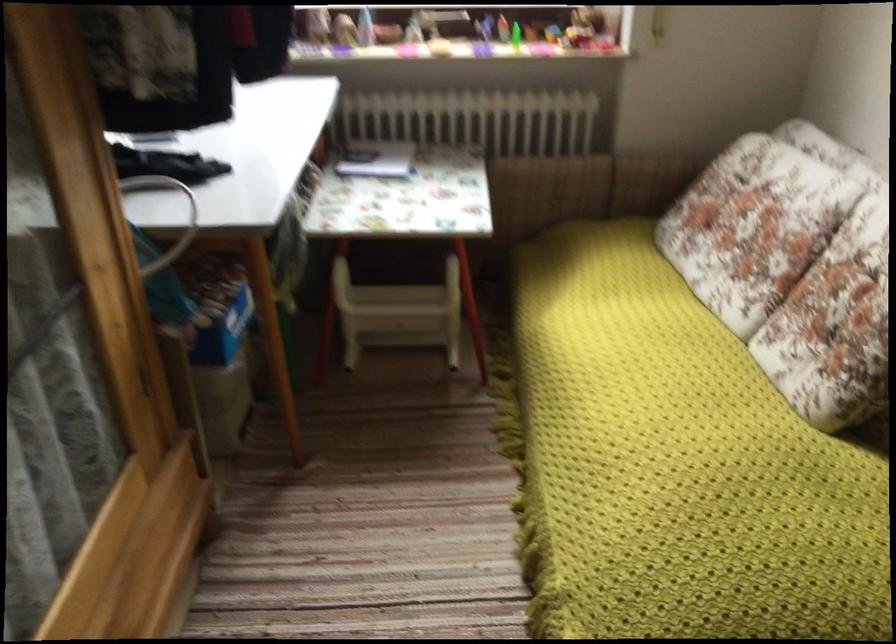
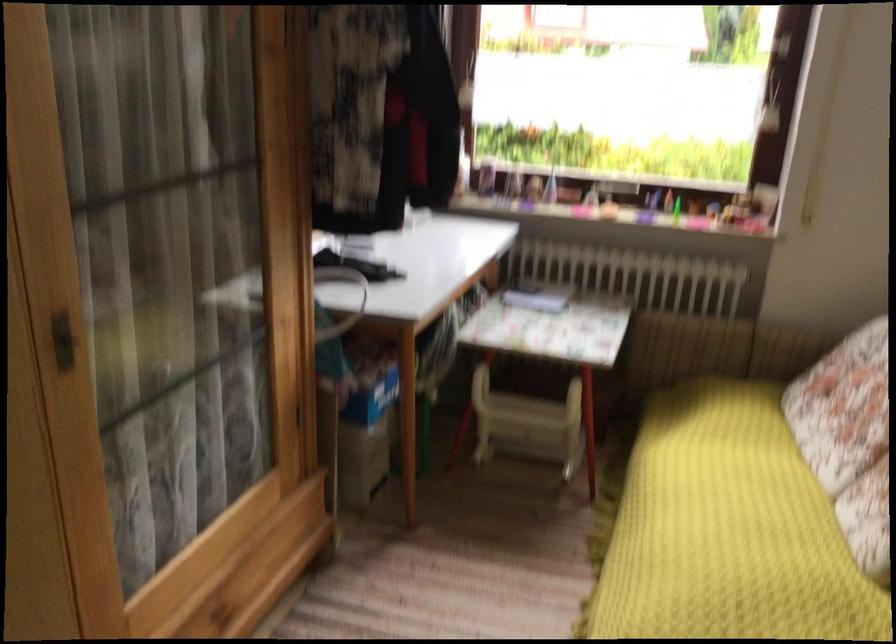
In the second image, find the point that corresponds to (209,314) in the first image.

(360, 381)